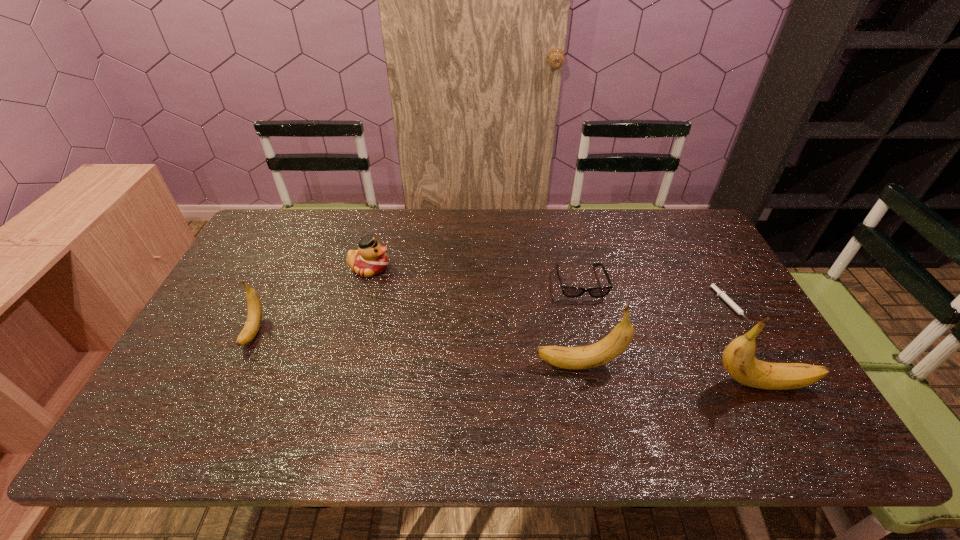
The image size is (960, 540). Find the location of `free space for an extra banana to achieve even spacing`. free space for an extra banana to achieve even spacing is located at coordinates (411, 348).